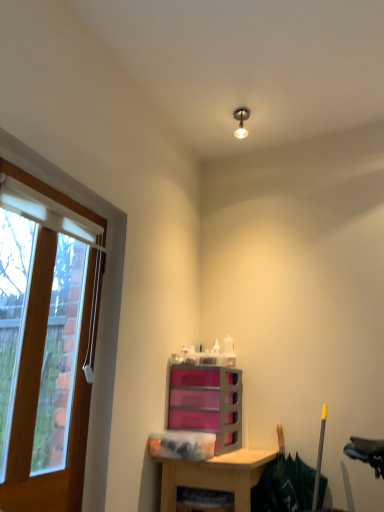
Question: Considering the relative sizes of wooden desk at lower center and wooden frame at left in the image provided, is wooden desk at lower center smaller than wooden frame at left?

Choices:
 (A) yes
 (B) no

Answer: (B)

Question: Considering the relative sizes of wooden desk at lower center and wooden frame at left in the image provided, is wooden desk at lower center shorter than wooden frame at left?

Choices:
 (A) no
 (B) yes

Answer: (B)

Question: Can wooden frame at left be found inside wooden desk at lower center?

Choices:
 (A) no
 (B) yes

Answer: (A)

Question: From a real-world perspective, does wooden desk at lower center sit lower than wooden frame at left?

Choices:
 (A) yes
 (B) no

Answer: (A)

Question: Would you consider wooden desk at lower center to be distant from wooden frame at left?

Choices:
 (A) yes
 (B) no

Answer: (B)

Question: Can you confirm if wooden desk at lower center is taller than wooden frame at left?

Choices:
 (A) yes
 (B) no

Answer: (B)

Question: Would you say metallic bulb at upper center is outside wooden desk at lower center?

Choices:
 (A) no
 (B) yes

Answer: (B)

Question: From a real-world perspective, does metallic bulb at upper center sit lower than wooden desk at lower center?

Choices:
 (A) no
 (B) yes

Answer: (A)

Question: Is metallic bulb at upper center touching wooden desk at lower center?

Choices:
 (A) no
 (B) yes

Answer: (A)

Question: Does metallic bulb at upper center come behind wooden desk at lower center?

Choices:
 (A) yes
 (B) no

Answer: (A)

Question: Can you confirm if metallic bulb at upper center is taller than wooden desk at lower center?

Choices:
 (A) yes
 (B) no

Answer: (B)

Question: Can you confirm if metallic bulb at upper center is wider than wooden desk at lower center?

Choices:
 (A) no
 (B) yes

Answer: (A)

Question: Is pink plastic drawers at center looking in the opposite direction of metallic bulb at upper center?

Choices:
 (A) no
 (B) yes

Answer: (A)